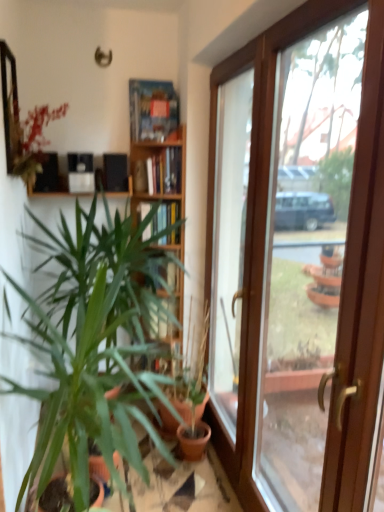
Find the location of a particular element. Image resolution: width=384 pixels, height=512 pixels. empty space that is ontop of matte black shelf at upper left (from a real-world perspective) is located at coordinates (84, 169).